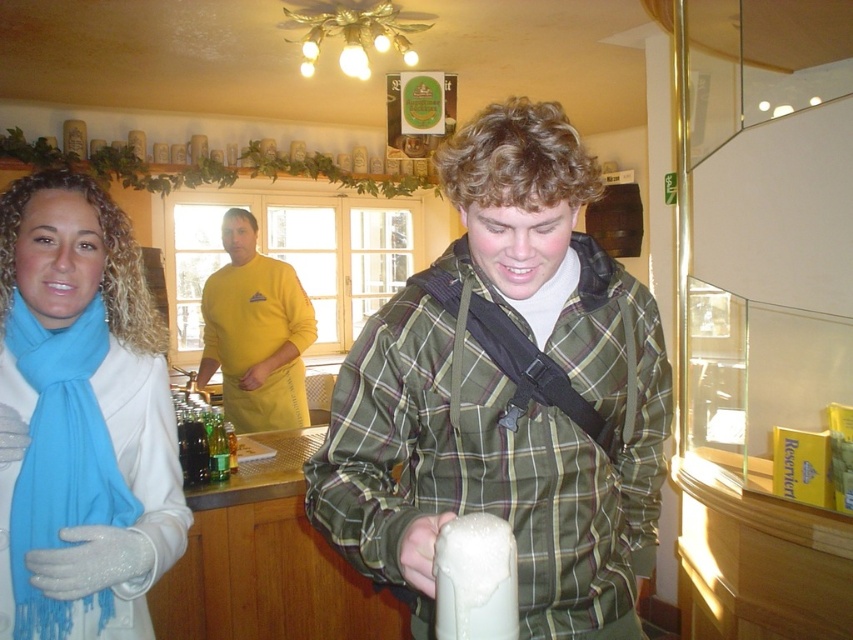
You are a bartender in this pub and need to reach the green glass bottles at center to prepare a drink. The green plaid jacket at center is in your way. Can you easily move around it to access the bottles?

The green plaid jacket at center is closer to the viewer than the green glass bottles at center, so you can move around it to access the bottles since it is in front of them.

You are a customer at the pub and want to place a small item on the table. The table has the turquoise soft scarf at left and the green glass bottles at center. Which object takes up more space on the table?

The green glass bottles at center take up more space on the table because the turquoise soft scarf at left occupies less space than them.

What is the 2D coordinate of the green plaid jacket at center?

The green plaid jacket at center is located at the 2D coordinate point of [508,394].